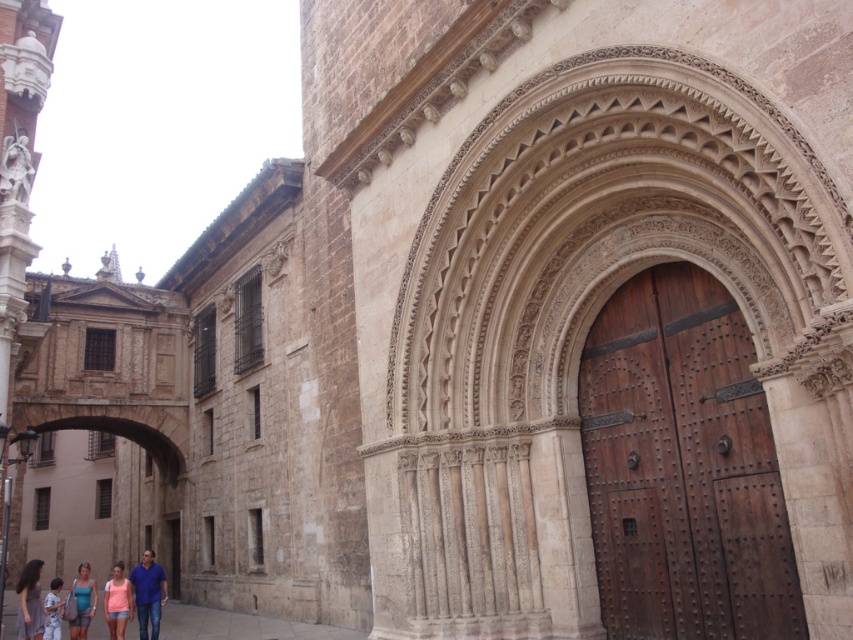
You are standing in front of the historic building and see the denim jeans at lower left and the light blue fabric shirt at lower left. If you want to pick up both items, which one do you need to walk towards first?

The denim jeans at lower left is 45.67 feet away from light blue fabric shirt at lower left, so you need to walk towards the denim jeans at lower left first since it is farther away than the light blue fabric shirt at lower left.

You are an architect visiting this historic building and want to measure the sizes of the brown wooden door at center and the light blue fabric shirt at lower left. Which object is smaller?

The brown wooden door at center is smaller than the light blue fabric shirt at lower left according to the description.

You are standing in front of the historic building and notice both the brown wooden door at center and the light blue fabric shirt at lower left. Which object is positioned higher from the ground?

The brown wooden door at center is located above the light blue fabric shirt at lower left, so the brown wooden door at center is higher from the ground.